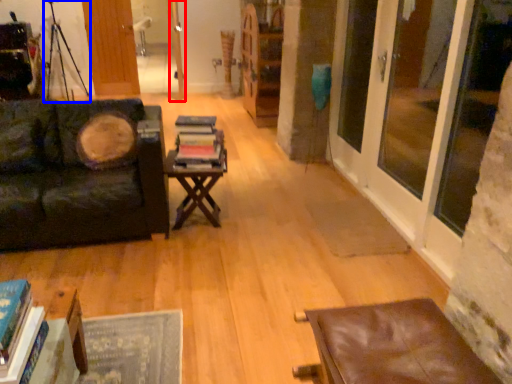
Question: Which object is further to the camera taking this photo, door (highlighted by a red box) or tripod (highlighted by a blue box)?

Choices:
 (A) door
 (B) tripod

Answer: (A)